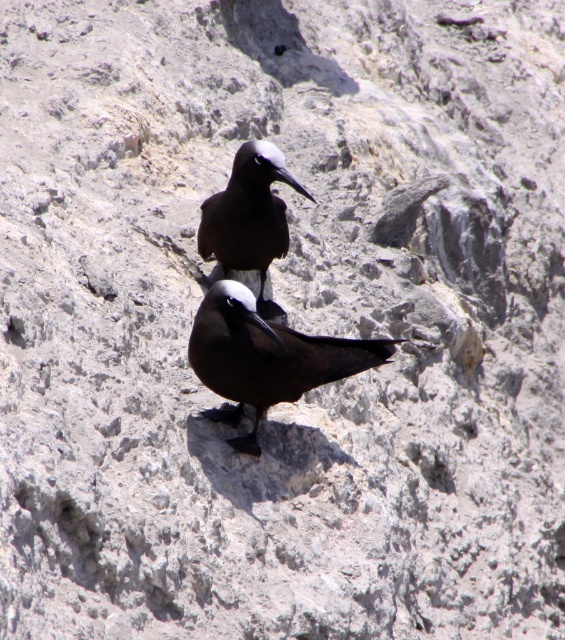
Does matte black bird at center have a lesser width compared to brown glossy bird at center?

In fact, matte black bird at center might be wider than brown glossy bird at center.

Does point (353, 340) lie behind point (270, 312)?

That is False.

Identify the location of matte black bird at center. The width and height of the screenshot is (565, 640). (266, 356).